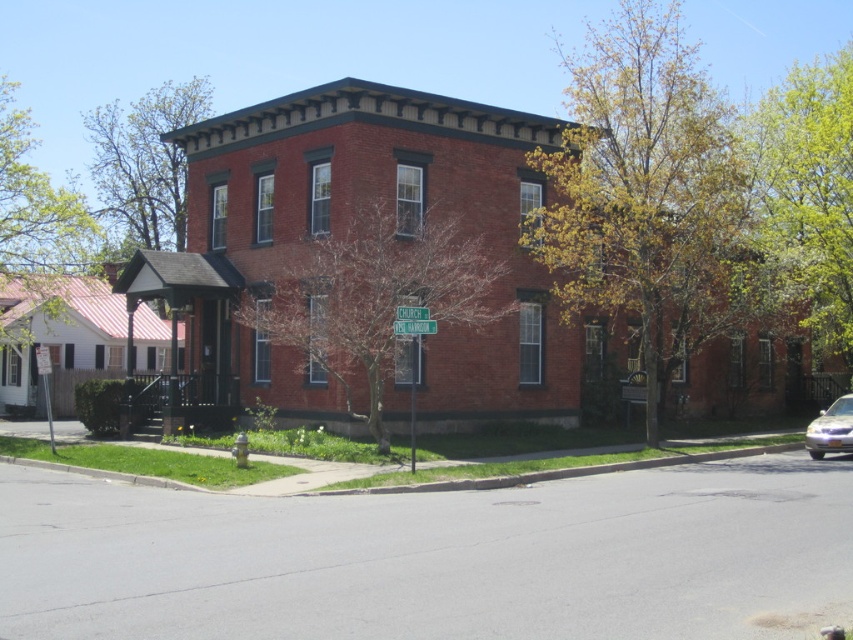
Question: Which of the following is the farthest from the observer?

Choices:
 (A) green leafy tree at upper left
 (B) satin blue sedan at lower right
 (C) bare branches at center
 (D) green leafy tree at upper center

Answer: (D)

Question: Which point is closer to the camera?

Choices:
 (A) green leafy tree at upper center
 (B) satin blue sedan at lower right

Answer: (B)

Question: Can you confirm if green leafy tree at upper right is wider than green leafy tree at upper center?

Choices:
 (A) no
 (B) yes

Answer: (B)

Question: Does green leafy tree at center have a greater width compared to bare branches at center?

Choices:
 (A) yes
 (B) no

Answer: (A)

Question: Can you confirm if bare branches at center is positioned to the right of green leafy tree at upper center?

Choices:
 (A) no
 (B) yes

Answer: (B)

Question: Which point is farther to the camera?

Choices:
 (A) click(813, 429)
 (B) click(833, 118)

Answer: (B)